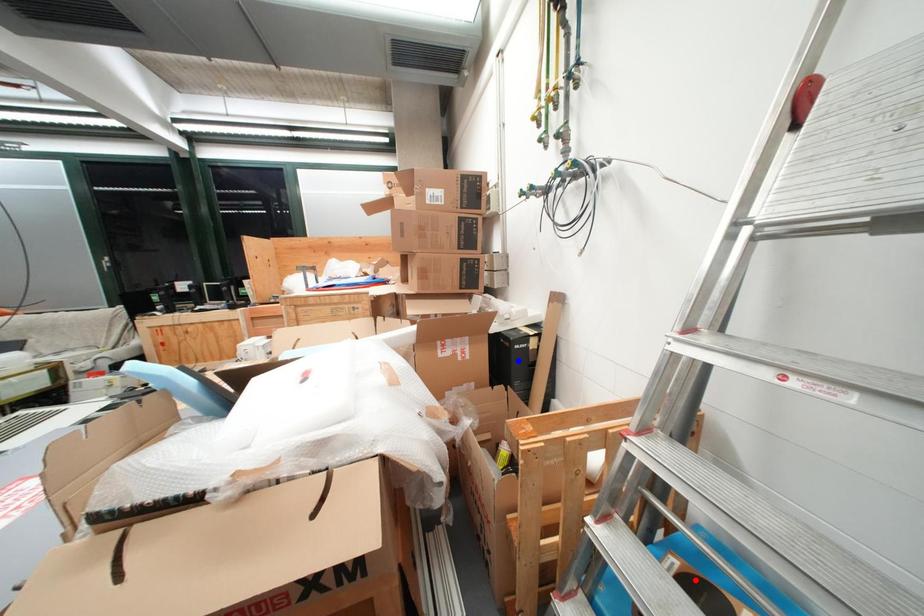
Question: Two points are marked on the image. Which point is closer to the camera?

Choices:
 (A) Blue point is closer.
 (B) Red point is closer.

Answer: (B)